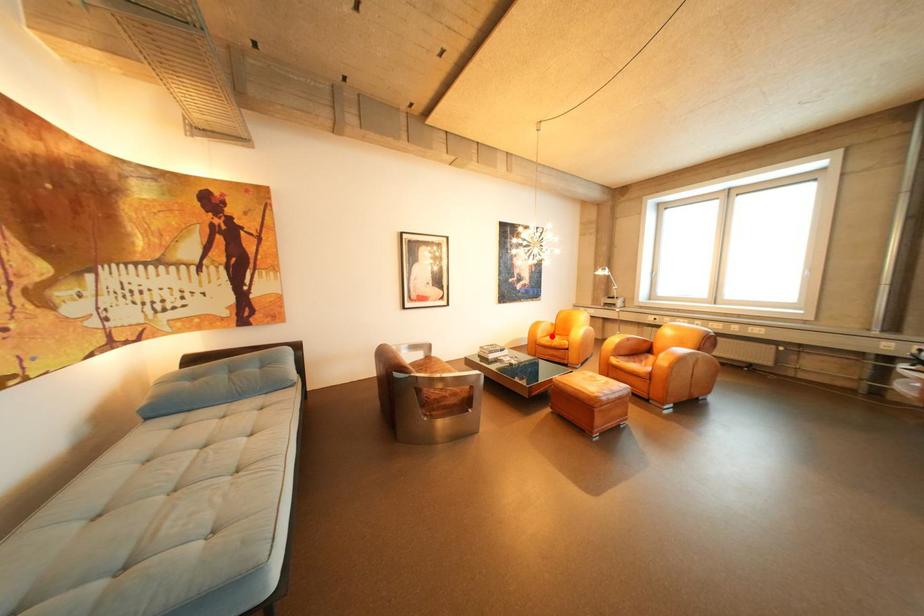
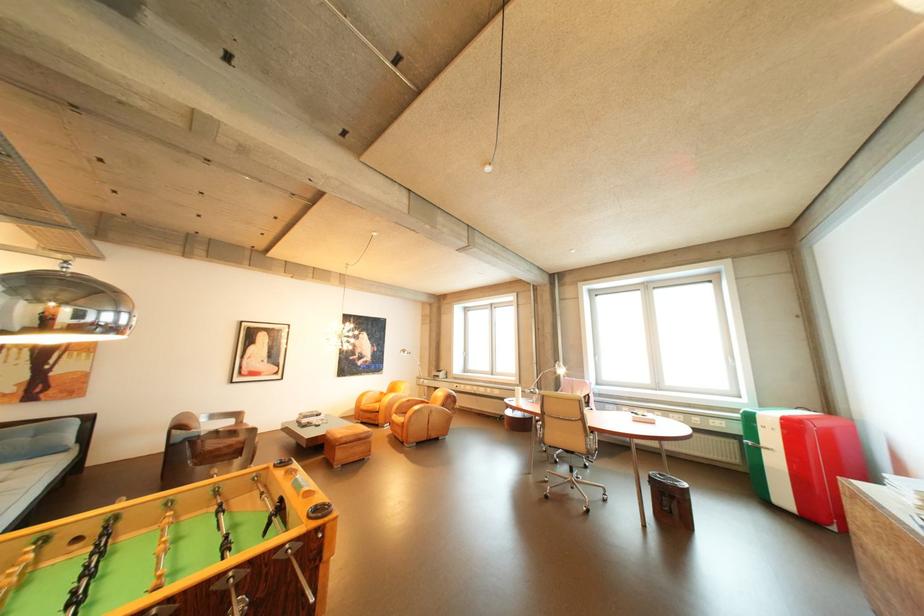
Question: I am providing you with two images of the same scene from different viewpoints. A red point is shown in image1. For the corresponding object point in image2, is it positioned nearer or farther from the camera?

Choices:
 (A) Nearer
 (B) Farther

Answer: (B)